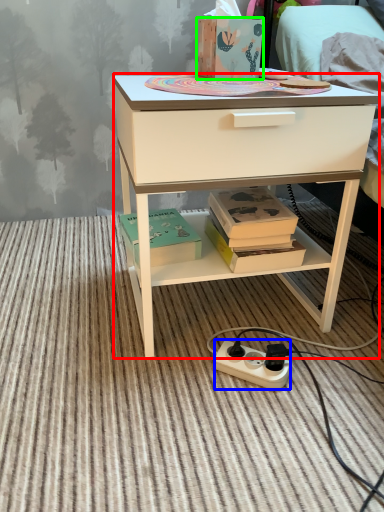
Question: Estimate the real-world distances between objects in this image. Which object is closer to desk (highlighted by a red box), power outlet (highlighted by a blue box) or box (highlighted by a green box)?

Choices:
 (A) power outlet
 (B) box

Answer: (B)